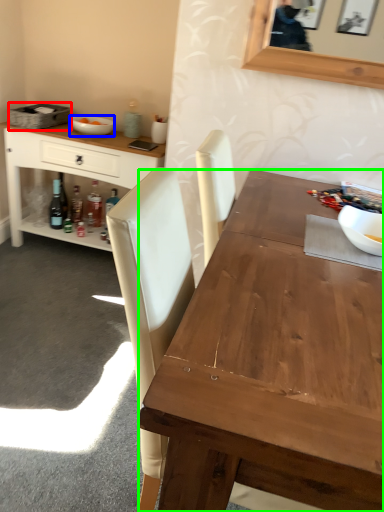
Question: Considering the real-world distances, which object is farthest from picnic basket (highlighted by a red box)? bowl (highlighted by a blue box) or desk (highlighted by a green box)?

Choices:
 (A) bowl
 (B) desk

Answer: (B)